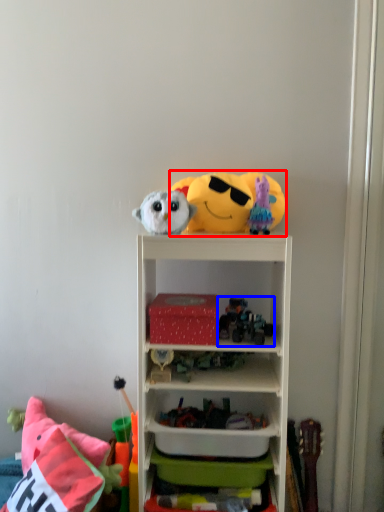
Question: Which of the following is the closest to the observer, toy (highlighted by a red box) or toy (highlighted by a blue box)?

Choices:
 (A) toy
 (B) toy

Answer: (B)